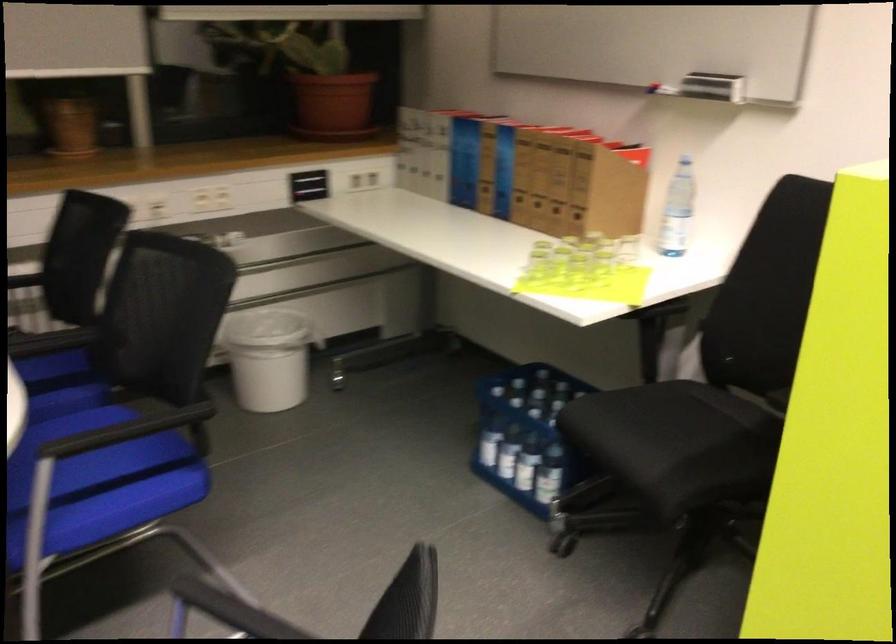
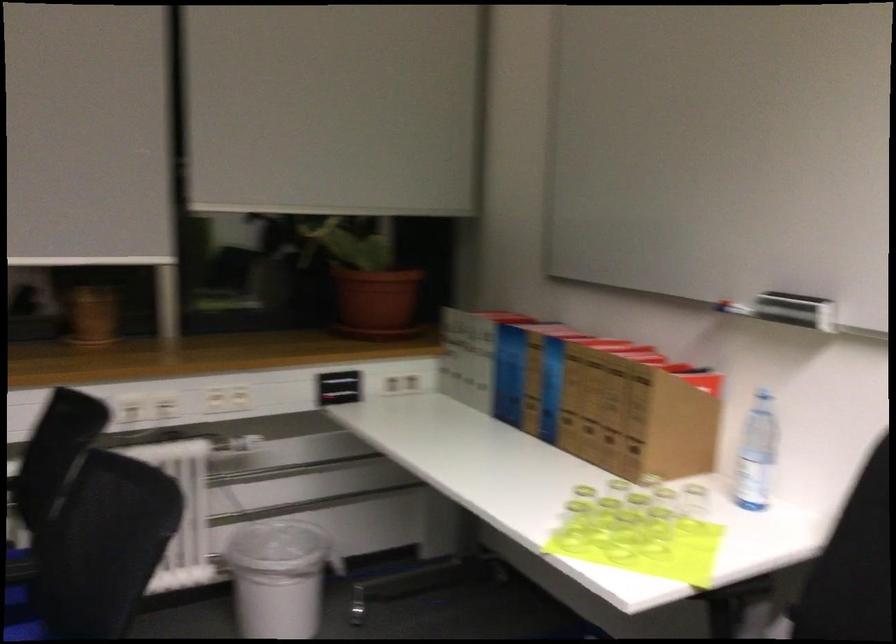
Find the pixel in the second image that matches (x=677, y=213) in the first image.

(755, 453)